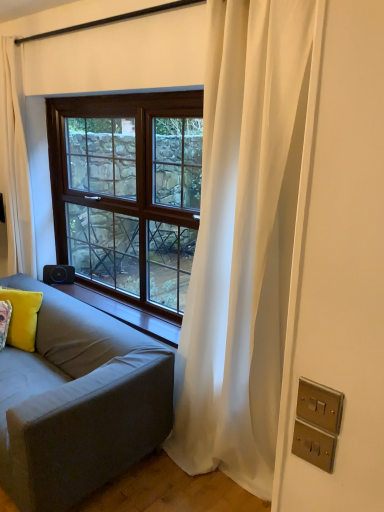
Measure the distance between satin gold switchplate at lower right, which is the 1th electric outlet from bottom to top, and camera.

satin gold switchplate at lower right, which is the 1th electric outlet from bottom to top, is 31.14 inches away from camera.

The image size is (384, 512). What do you see at coordinates (246, 240) in the screenshot?
I see `white sheer curtain at right, which appears as the 2th curtain when viewed from the back` at bounding box center [246, 240].

In order to click on brown wood window sill at lower left in this screenshot , I will do `click(125, 313)`.

Image resolution: width=384 pixels, height=512 pixels. What do you see at coordinates (58, 274) in the screenshot?
I see `black plastic speaker at lower left` at bounding box center [58, 274].

What do you see at coordinates (78, 402) in the screenshot?
I see `gray fabric couch at left` at bounding box center [78, 402].

At what (x,y) coordinates should I click in order to perform the action: click on satin gold switchplate at lower right, which is the 1th electric outlet from bottom to top. Please return your answer as a coordinate pair (x, y). This screenshot has height=512, width=384. Looking at the image, I should click on 314,445.

Looking at this image, is brown wooden window at center positioned with its back to white sheer curtain at left, which is counted as the first curtain, starting from the left?

No, brown wooden window at center is not facing the opposite direction of white sheer curtain at left, which is counted as the first curtain, starting from the left.

In the scene shown: Is brown wooden window at center situated inside white sheer curtain at left, which is counted as the first curtain, starting from the left, or outside?

brown wooden window at center cannot be found inside white sheer curtain at left, which is counted as the first curtain, starting from the left.

In terms of size, does brown wooden window at center appear bigger or smaller than white sheer curtain at left, which is counted as the first curtain, starting from the left?

brown wooden window at center is smaller than white sheer curtain at left, which is counted as the first curtain, starting from the left.

From the image's perspective, between brown wooden window at center and white sheer curtain at left, the 2th curtain viewed from the front, who is located below?

brown wooden window at center.

Can you confirm if white sheer curtain at left, the 2th curtain viewed from the front, is wider than brown wood window sill at lower left?

Indeed, white sheer curtain at left, the 2th curtain viewed from the front, has a greater width compared to brown wood window sill at lower left.

Is white sheer curtain at left, the second curtain when ordered from right to left, looking in the opposite direction of brown wood window sill at lower left?

No, white sheer curtain at left, the second curtain when ordered from right to left,'s orientation is not away from brown wood window sill at lower left.

In the scene shown: Who is smaller, white sheer curtain at left, the first curtain when ordered from back to front, or brown wood window sill at lower left?

With smaller size is brown wood window sill at lower left.

Considering the points (9, 169) and (115, 302), which point is in front, point (9, 169) or point (115, 302)?

The point (115, 302) is in front.

Visually, is satin gold switchplate at lower right, which is the 1th electric outlet from bottom to top, positioned to the left or to the right of gray fabric couch at left?

In the image, satin gold switchplate at lower right, which is the 1th electric outlet from bottom to top, appears on the right side of gray fabric couch at left.

Is satin gold switchplate at lower right, which is the 1th electric outlet from bottom to top, bigger or smaller than gray fabric couch at left?

Clearly, satin gold switchplate at lower right, which is the 1th electric outlet from bottom to top, is smaller in size than gray fabric couch at left.

From the image's perspective, which is above, satin gold switchplate at lower right, which is the 1th electric outlet from bottom to top, or gray fabric couch at left?

satin gold switchplate at lower right, which is the 1th electric outlet from bottom to top.

How different are the orientations of satin brass switchplate at lower right, the 1th electric outlet from the top, and satin gold switchplate at lower right, which is the 1th electric outlet from bottom to top, in degrees?

There is a 0-degree angle between the facing directions of satin brass switchplate at lower right, the 1th electric outlet from the top, and satin gold switchplate at lower right, which is the 1th electric outlet from bottom to top.

From a real-world perspective, is satin brass switchplate at lower right, marked as the second electric outlet in a bottom-to-top arrangement, positioned above or below satin gold switchplate at lower right, which ranks as the 2th electric outlet in top-to-bottom order?

satin brass switchplate at lower right, marked as the second electric outlet in a bottom-to-top arrangement, is above satin gold switchplate at lower right, which ranks as the 2th electric outlet in top-to-bottom order.

Consider the image. Can you confirm if satin brass switchplate at lower right, the 1th electric outlet from the top, is taller than satin gold switchplate at lower right, which is the 1th electric outlet from bottom to top?

No.

Can you confirm if satin brass switchplate at lower right, the 1th electric outlet from the top, is wider than satin gold switchplate at lower right, which ranks as the 2th electric outlet in top-to-bottom order?

No.

Considering the positions of points (323, 418) and (98, 410), is point (323, 418) farther from camera compared to point (98, 410)?

No, (323, 418) is in front of (98, 410).

Looking at this image, from a real-world perspective, is satin brass switchplate at lower right, marked as the second electric outlet in a bottom-to-top arrangement, positioned under gray fabric couch at left based on gravity?

No, from a real-world perspective, satin brass switchplate at lower right, marked as the second electric outlet in a bottom-to-top arrangement, is not beneath gray fabric couch at left.

Is satin brass switchplate at lower right, marked as the second electric outlet in a bottom-to-top arrangement, not inside gray fabric couch at left?

satin brass switchplate at lower right, marked as the second electric outlet in a bottom-to-top arrangement, is positioned outside gray fabric couch at left.

Can you tell me how much satin brass switchplate at lower right, the 1th electric outlet from the top, and gray fabric couch at left differ in facing direction?

They differ by 1.89 degrees in their facing directions.

Who is bigger, white sheer curtain at right, which appears as the 2th curtain when viewed from the back, or brown wooden window at center?

With larger size is white sheer curtain at right, which appears as the 2th curtain when viewed from the back.

Identify the location of curtain beneath the brown wooden window at center (from a real-world perspective). (246, 240).

From the image's perspective, is white sheer curtain at right, which appears as the 2th curtain when viewed from the back, above or below brown wooden window at center?

white sheer curtain at right, which appears as the 2th curtain when viewed from the back, is situated lower than brown wooden window at center in the image.

Does white sheer curtain at right, the 2th curtain when ordered from left to right, appear on the right side of brown wooden window at center?

Correct, you'll find white sheer curtain at right, the 2th curtain when ordered from left to right, to the right of brown wooden window at center.

Is brown wood window sill at lower left placed right next to black plastic speaker at lower left?

There is a gap between brown wood window sill at lower left and black plastic speaker at lower left.

Considering the positions of points (156, 322) and (67, 266), is point (156, 322) farther from camera compared to point (67, 266)?

No, it is not.

Which of these two, brown wood window sill at lower left or black plastic speaker at lower left, stands shorter?

Standing shorter between the two is brown wood window sill at lower left.

Find the location of a particular element. The width and height of the screenshot is (384, 512). window sill below the black plastic speaker at lower left (from a real-world perspective) is located at coordinates (125, 313).

In the image, there is a white sheer curtain at left, which is counted as the first curtain, starting from the left. At what (x,y) coordinates should I click in order to perform the action: click on window below it (from a real-world perspective). Please return your answer as a coordinate pair (x, y). Looking at the image, I should click on (128, 191).

From a real-world perspective, count 2nd curtains upward from the brown wood window sill at lower left and point to it. Please provide its 2D coordinates.

[(15, 164)]

Considering their positions, is brown wooden window at center positioned closer to yellow velvet pillow at lower left than white sheer curtain at left, which is counted as the first curtain, starting from the left?

Based on the image, white sheer curtain at left, which is counted as the first curtain, starting from the left, appears to be nearer to yellow velvet pillow at lower left.

In the scene shown: When comparing their distances from brown wooden window at center, does satin gold switchplate at lower right, which ranks as the 2th electric outlet in top-to-bottom order, or yellow velvet pillow at lower left seem further?

satin gold switchplate at lower right, which ranks as the 2th electric outlet in top-to-bottom order, is further to brown wooden window at center.

Which object lies nearer to the anchor point satin brass switchplate at lower right, marked as the second electric outlet in a bottom-to-top arrangement, white sheer curtain at right, which appears as the 2th curtain when viewed from the back, or satin gold switchplate at lower right, which ranks as the 2th electric outlet in top-to-bottom order?

satin gold switchplate at lower right, which ranks as the 2th electric outlet in top-to-bottom order, is closer to satin brass switchplate at lower right, marked as the second electric outlet in a bottom-to-top arrangement.

Based on their spatial positions, is satin brass switchplate at lower right, marked as the second electric outlet in a bottom-to-top arrangement, or yellow velvet pillow at lower left closer to black plastic speaker at lower left?

Among the two, yellow velvet pillow at lower left is located nearer to black plastic speaker at lower left.

Considering their positions, is brown wood window sill at lower left positioned closer to black plastic speaker at lower left than yellow velvet pillow at lower left?

brown wood window sill at lower left lies closer to black plastic speaker at lower left than the other object.

Which object lies further to the anchor point satin brass switchplate at lower right, the 1th electric outlet from the top, satin gold switchplate at lower right, which is the 1th electric outlet from bottom to top, or white sheer curtain at right, positioned as the 1th curtain in front-to-back order?

white sheer curtain at right, positioned as the 1th curtain in front-to-back order, lies further to satin brass switchplate at lower right, the 1th electric outlet from the top, than the other object.

Considering their positions, is satin gold switchplate at lower right, which ranks as the 2th electric outlet in top-to-bottom order, positioned further to white sheer curtain at left, which is counted as the first curtain, starting from the left, than black plastic speaker at lower left?

Among the two, satin gold switchplate at lower right, which ranks as the 2th electric outlet in top-to-bottom order, is located further to white sheer curtain at left, which is counted as the first curtain, starting from the left.

Which object lies further to the anchor point satin brass switchplate at lower right, the 1th electric outlet from the top, black plastic speaker at lower left or white sheer curtain at left, the first curtain when ordered from back to front?

white sheer curtain at left, the first curtain when ordered from back to front, lies further to satin brass switchplate at lower right, the 1th electric outlet from the top, than the other object.

Where is `window between white sheer curtain at left, the 2th curtain viewed from the front, and white sheer curtain at right, positioned as the 1th curtain in front-to-back order, from left to right`? This screenshot has width=384, height=512. window between white sheer curtain at left, the 2th curtain viewed from the front, and white sheer curtain at right, positioned as the 1th curtain in front-to-back order, from left to right is located at coordinates (128, 191).

At what (x,y) coordinates should I click in order to perform the action: click on electric outlet between satin brass switchplate at lower right, marked as the second electric outlet in a bottom-to-top arrangement, and white sheer curtain at left, the 2th curtain viewed from the front, in the front-back direction. Please return your answer as a coordinate pair (x, y). Looking at the image, I should click on (314, 445).

Identify the location of speaker between white sheer curtain at left, the second curtain when ordered from right to left, and yellow velvet pillow at lower left, in the vertical direction. (58, 274).

Where is `window positioned between satin gold switchplate at lower right, which is the 1th electric outlet from bottom to top, and yellow velvet pillow at lower left from near to far`? window positioned between satin gold switchplate at lower right, which is the 1th electric outlet from bottom to top, and yellow velvet pillow at lower left from near to far is located at coordinates (128, 191).